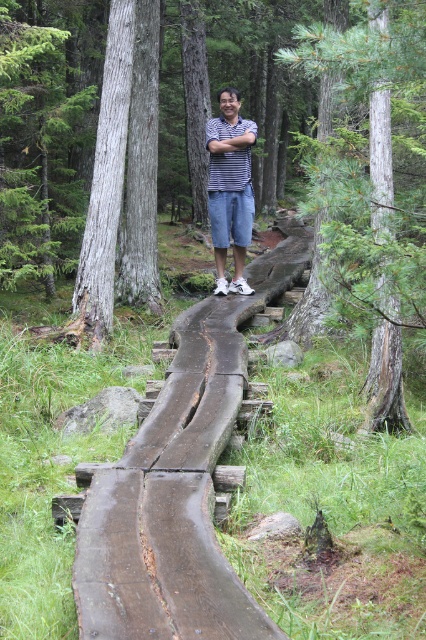
Question: Is the position of green textured tree trunk at center less distant than that of striped cotton shirt at center?

Choices:
 (A) no
 (B) yes

Answer: (B)

Question: Where is brown rough wood at center located in relation to green textured tree trunk at center in the image?

Choices:
 (A) right
 (B) left

Answer: (B)

Question: Which point is farther to the camera?

Choices:
 (A) (362, 216)
 (B) (219, 128)
 (C) (229, 122)

Answer: (C)

Question: Which object is closer to the camera taking this photo?

Choices:
 (A) green textured tree trunk at center
 (B) brown rough wood at center
 (C) striped cotton shirt at center

Answer: (B)

Question: Considering the relative positions of striped fabric shirt at center and striped cotton shirt at center in the image provided, where is striped fabric shirt at center located with respect to striped cotton shirt at center?

Choices:
 (A) above
 (B) below

Answer: (B)

Question: Which point is farther to the camera?

Choices:
 (A) striped cotton shirt at center
 (B) brown rough wood at center
 (C) striped fabric shirt at center

Answer: (C)